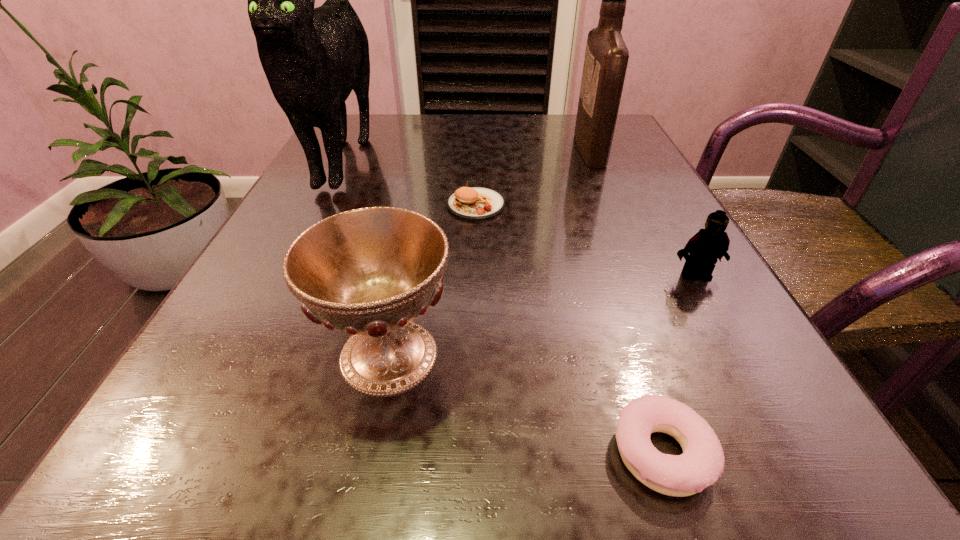
This screenshot has width=960, height=540. Find the location of `blank space located on the label side of the second tallest object`. blank space located on the label side of the second tallest object is located at coordinates (452, 150).

Image resolution: width=960 pixels, height=540 pixels. I want to click on free location located 0.170m on the label side of the second tallest object, so click(498, 150).

Locate an element on the screen. The height and width of the screenshot is (540, 960). vacant area situated on the right of the fourth shortest object is located at coordinates (521, 355).

The height and width of the screenshot is (540, 960). Find the location of `vacant space located on the face of the rightmost object`. vacant space located on the face of the rightmost object is located at coordinates (827, 507).

At what (x,y) coordinates should I click in order to perform the action: click on blank space located 0.060m on the left of the patty. Please return your answer as a coordinate pair (x, y). This screenshot has height=540, width=960. Looking at the image, I should click on (413, 205).

Where is `free spot located 0.200m on the back of the doughnut`? free spot located 0.200m on the back of the doughnut is located at coordinates (608, 285).

Where is `cat positioned at the far edge`? This screenshot has width=960, height=540. cat positioned at the far edge is located at coordinates (313, 58).

Find the location of a particular element. The width and height of the screenshot is (960, 540). liquor that is at the far edge is located at coordinates (606, 58).

This screenshot has width=960, height=540. I want to click on object at the near edge, so tap(701, 464).

This screenshot has width=960, height=540. In order to click on cat located in the left edge section of the desktop in this screenshot , I will do `click(313, 58)`.